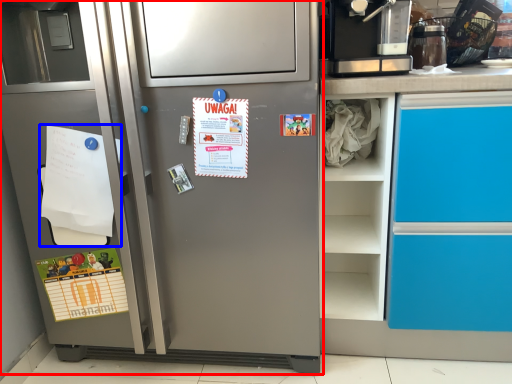
Question: Among these objects, which one is farthest to the camera, refrigerator (highlighted by a red box) or flyer (highlighted by a blue box)?

Choices:
 (A) refrigerator
 (B) flyer

Answer: (B)